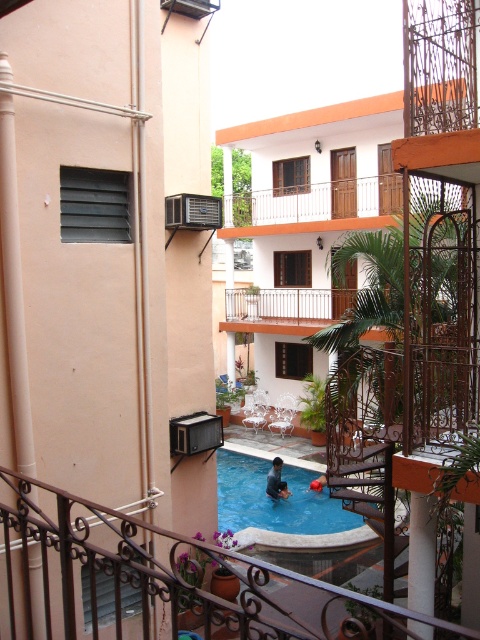
You are standing on a balcony and want to reach the edge to take a photo of the pool. The black wrought iron railing at lower center is in your way. Can you step over it safely if you know your height is 5 feet 6 inches?

The black wrought iron railing at lower center is 8.28 feet away from you. Since the distance between you and the railing is greater than your height of 5 feet 6 inches, you can safely step over it.

You are standing on the balcony and want to place a new potted plant between the matte black air conditioner at left and the blue glossy pool at center. Based on their positions, which object is closer to you so you can place the plant there?

The matte black air conditioner at left is positioned over the blue glossy pool at center, meaning it is closer to you. Place the potted plant near the matte black air conditioner at left.

You are standing on the white wood balcony at upper center and want to look down at the pool area. Which object must you look over to see the black wrought iron railing at lower center?

The black wrought iron railing at lower center is located below the white wood balcony at upper center, so you must look over the white wood balcony at upper center to see the railing.